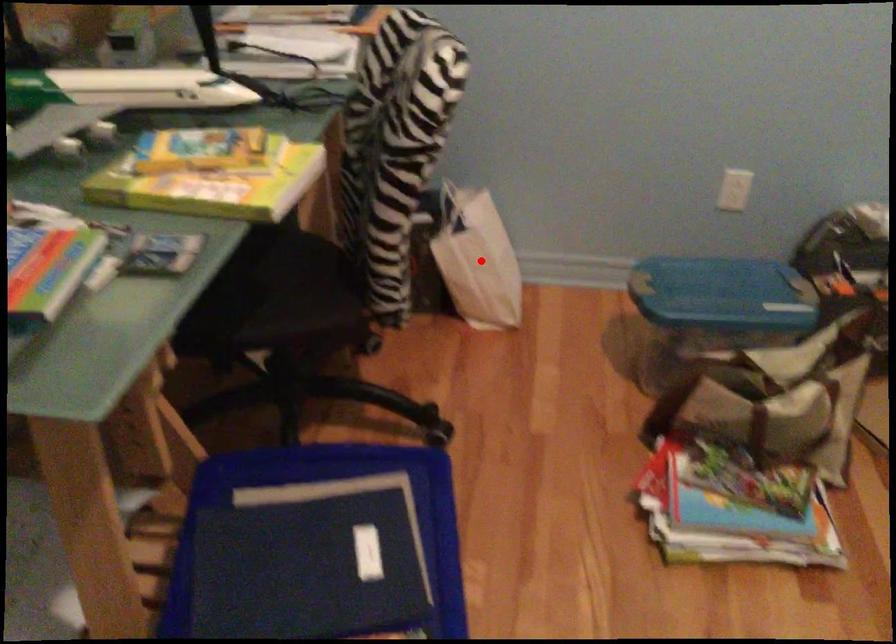
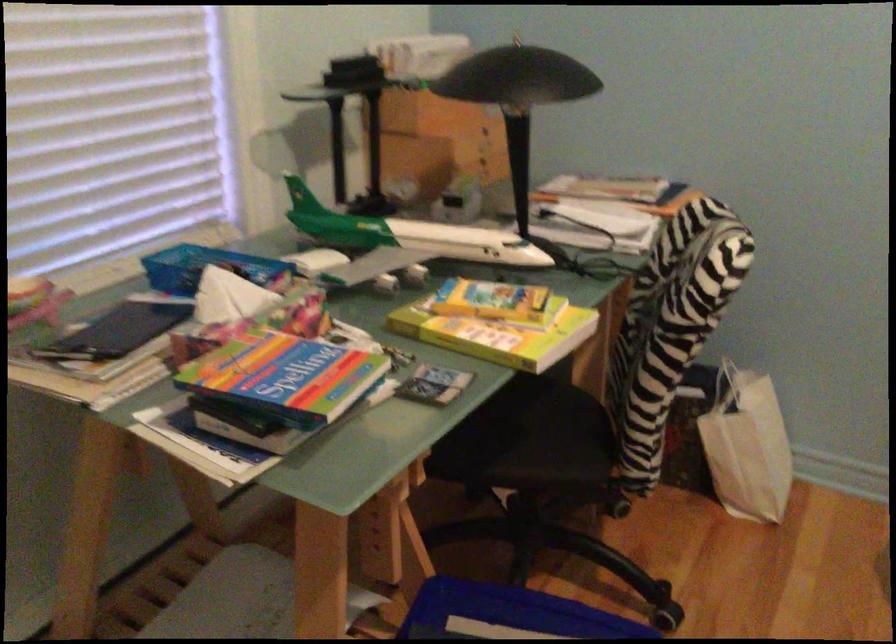
In the second image, find the point that corresponds to the highlighted location in the first image.

(746, 446)